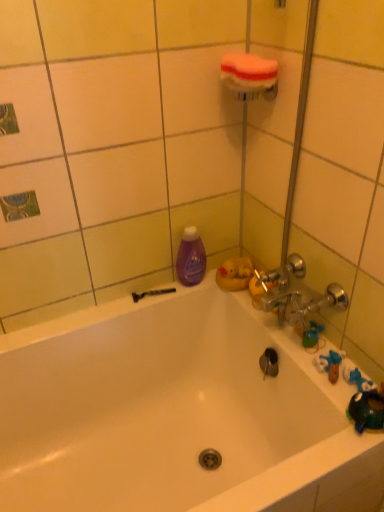
At what (x,y) coordinates should I click in order to perform the action: click on vacant space to the right of black plastic razor at lower left. Please return your answer as a coordinate pair (x, y). This screenshot has width=384, height=512. Looking at the image, I should click on (200, 289).